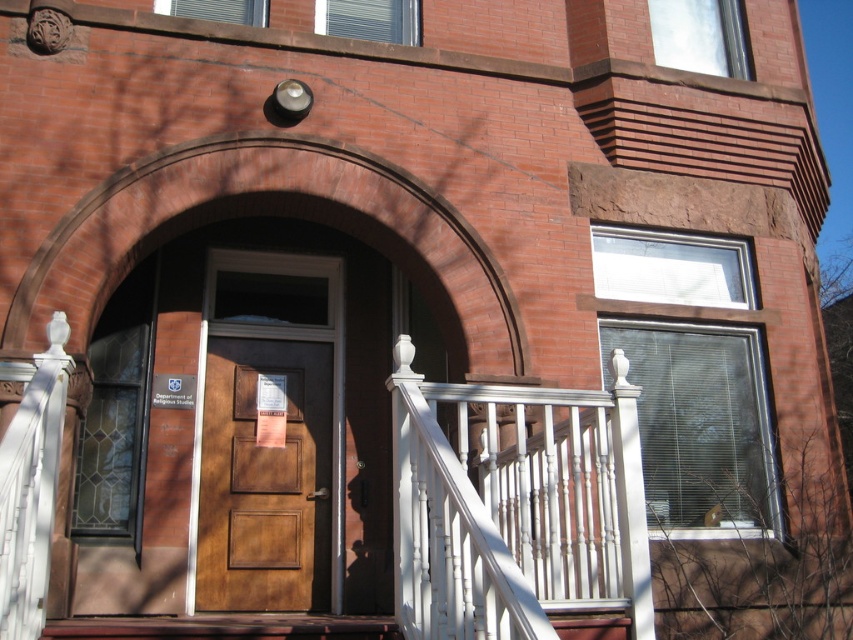
Is the position of white painted wood porch at center more distant than that of brown wood door at center?

No, white painted wood porch at center is closer to the viewer.

Can you confirm if white painted wood porch at center is shorter than brown wood door at center?

Correct, white painted wood porch at center is not as tall as brown wood door at center.

What do you see at coordinates (515, 506) in the screenshot? I see `white painted wood porch at center` at bounding box center [515, 506].

Where is `white painted wood porch at center`? This screenshot has width=853, height=640. white painted wood porch at center is located at coordinates (515, 506).

Is white painted wood balustrade at lower center to the right of wooden stairs at center from the viewer's perspective?

Indeed, white painted wood balustrade at lower center is positioned on the right side of wooden stairs at center.

At what (x,y) coordinates should I click in order to perform the action: click on white painted wood balustrade at lower center. Please return your answer as a coordinate pair (x, y). The width and height of the screenshot is (853, 640). Looking at the image, I should click on (515, 506).

Between point (602, 544) and point (390, 620), which one is positioned in front?

Positioned in front is point (602, 544).

The height and width of the screenshot is (640, 853). Find the location of `white painted wood balustrade at lower center`. white painted wood balustrade at lower center is located at coordinates (515, 506).

Does white painted wood porch at center appear under white painted wood balustrade at lower center?

No.

Between white painted wood porch at center and white painted wood balustrade at lower center, which one is positioned lower?

Positioned lower is white painted wood balustrade at lower center.

Is point (532, 490) in front of point (415, 573)?

No.

Where is `white painted wood porch at center`? Image resolution: width=853 pixels, height=640 pixels. white painted wood porch at center is located at coordinates (515, 506).